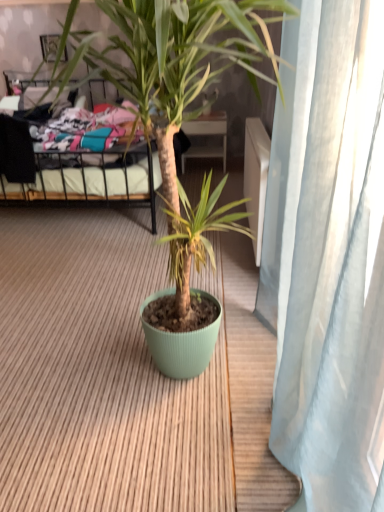
The height and width of the screenshot is (512, 384). Identify the location of vacant space underneath matte green pot at center (from a real-world perspective). (x=141, y=365).